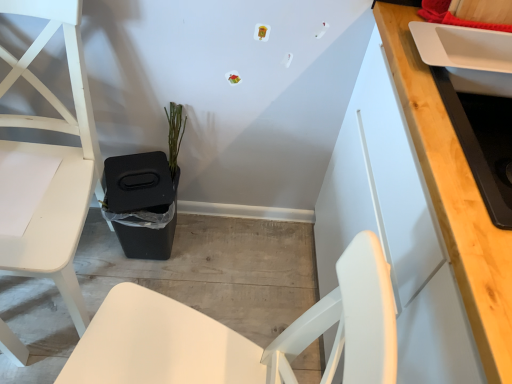
Question: Can you confirm if green matte plant at center is smaller than white glossy sink at upper right?

Choices:
 (A) no
 (B) yes

Answer: (B)

Question: From the image's perspective, does green matte plant at center appear higher than white glossy sink at upper right?

Choices:
 (A) no
 (B) yes

Answer: (B)

Question: Is white glossy sink at upper right at the back of green matte plant at center?

Choices:
 (A) yes
 (B) no

Answer: (B)

Question: Is green matte plant at center closer to the viewer compared to white glossy sink at upper right?

Choices:
 (A) yes
 (B) no

Answer: (B)

Question: Is green matte plant at center further to the viewer compared to white glossy sink at upper right?

Choices:
 (A) no
 (B) yes

Answer: (B)

Question: Considering the relative positions of green matte plant at center and white glossy sink at upper right in the image provided, is green matte plant at center to the left of white glossy sink at upper right from the viewer's perspective?

Choices:
 (A) yes
 (B) no

Answer: (A)

Question: Considering the relative sizes of white glossy sink at upper right and white matte chair at left in the image provided, is white glossy sink at upper right bigger than white matte chair at left?

Choices:
 (A) no
 (B) yes

Answer: (A)

Question: Can you confirm if white glossy sink at upper right is taller than white matte chair at left?

Choices:
 (A) yes
 (B) no

Answer: (B)

Question: From the image's perspective, is white glossy sink at upper right located above white matte chair at left?

Choices:
 (A) yes
 (B) no

Answer: (A)

Question: Is white glossy sink at upper right shorter than white matte chair at left?

Choices:
 (A) no
 (B) yes

Answer: (B)

Question: Can you confirm if white glossy sink at upper right is wider than white matte chair at left?

Choices:
 (A) yes
 (B) no

Answer: (B)

Question: Considering the relative sizes of white glossy sink at upper right and white matte chair at left in the image provided, is white glossy sink at upper right thinner than white matte chair at left?

Choices:
 (A) no
 (B) yes

Answer: (B)

Question: Is white matte chair at left not within green matte plant at center?

Choices:
 (A) yes
 (B) no

Answer: (A)